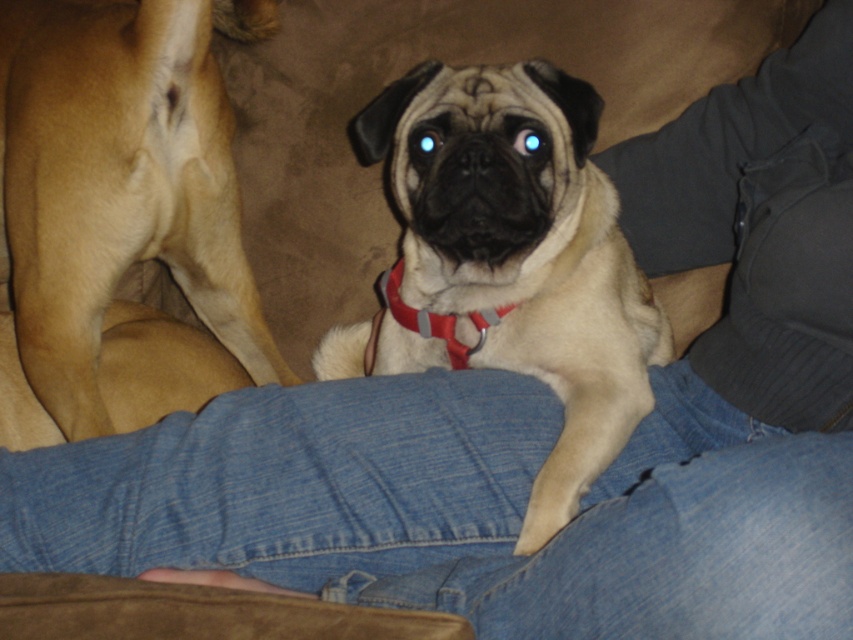
Question: Can you confirm if furry beige dog at center is positioned to the right of red nylon collar at center?

Choices:
 (A) no
 (B) yes

Answer: (B)

Question: Which of the following is the farthest from the observer?

Choices:
 (A) (202, 177)
 (B) (440, 332)

Answer: (A)

Question: Which object is the farthest from the red nylon collar at center?

Choices:
 (A) light brown fur at left
 (B) furry beige dog at center

Answer: (A)

Question: Does furry beige dog at center have a greater width compared to light brown fur at left?

Choices:
 (A) no
 (B) yes

Answer: (B)

Question: Can you confirm if furry beige dog at center is wider than light brown fur at left?

Choices:
 (A) no
 (B) yes

Answer: (B)

Question: Estimate the real-world distances between objects in this image. Which object is farther from the light brown fur at left?

Choices:
 (A) furry beige dog at center
 (B) red nylon collar at center

Answer: (A)